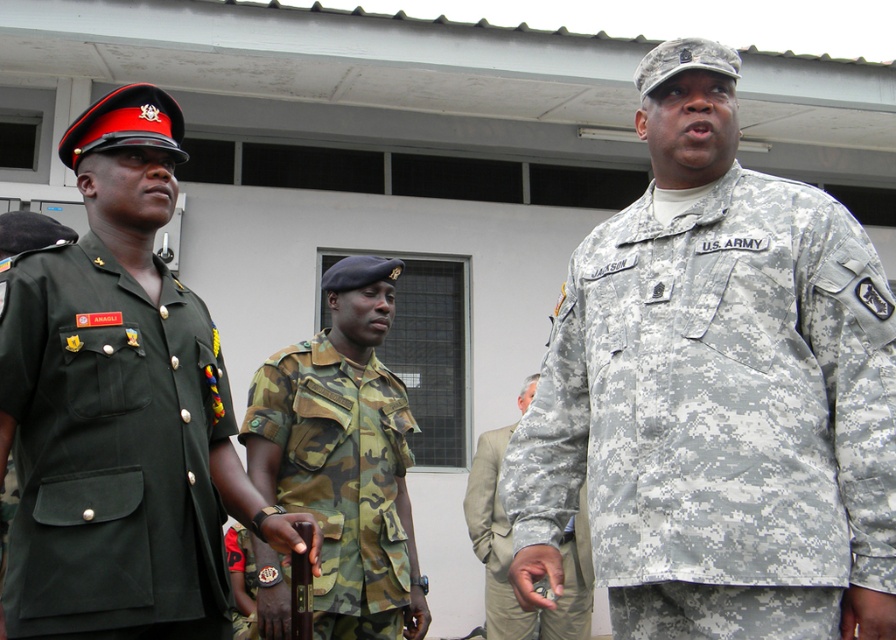
You are a photographer at this event and need to ensure all participants fit within the camera frame. Given that the camera can only accommodate up to two people side by side, will both the camouflage fabric us army uniform at center and the camouflage fabric uniform at center fit together in the frame?

The camouflage fabric us army uniform at center is wider than the camouflage fabric uniform at center. Since the camera can only fit two people side by side, their combined width may exceed the frame capacity. Therefore, it might not fit both together.

What is the relationship in height between the camouflage fabric US Army uniform at center and the camo fabric uniform at center?

The camouflage fabric US Army uniform at center is taller than the camo fabric uniform at center.

You are a photographer at this event and need to capture a photo that includes both the camo fabric uniform at center and the camouflage fabric uniform at center. Which one is on the left side?

The camo fabric uniform at center is positioned on the left side of the camouflage fabric uniform at center.